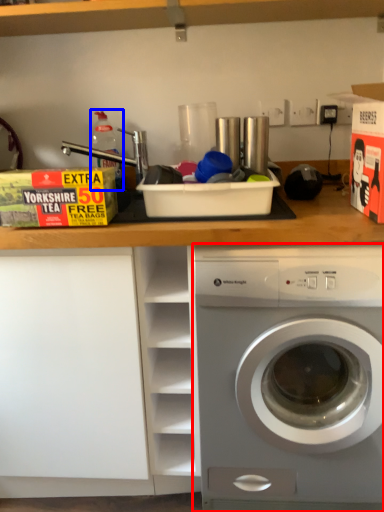
Question: Among these objects, which one is nearest to the camera, washing machine (highlighted by a red box) or bottle (highlighted by a blue box)?

Choices:
 (A) washing machine
 (B) bottle

Answer: (A)